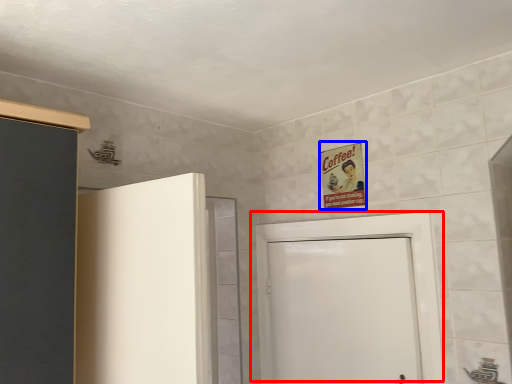
Question: Which of the following is the closest to the observer, door (highlighted by a red box) or poster (highlighted by a blue box)?

Choices:
 (A) door
 (B) poster

Answer: (A)